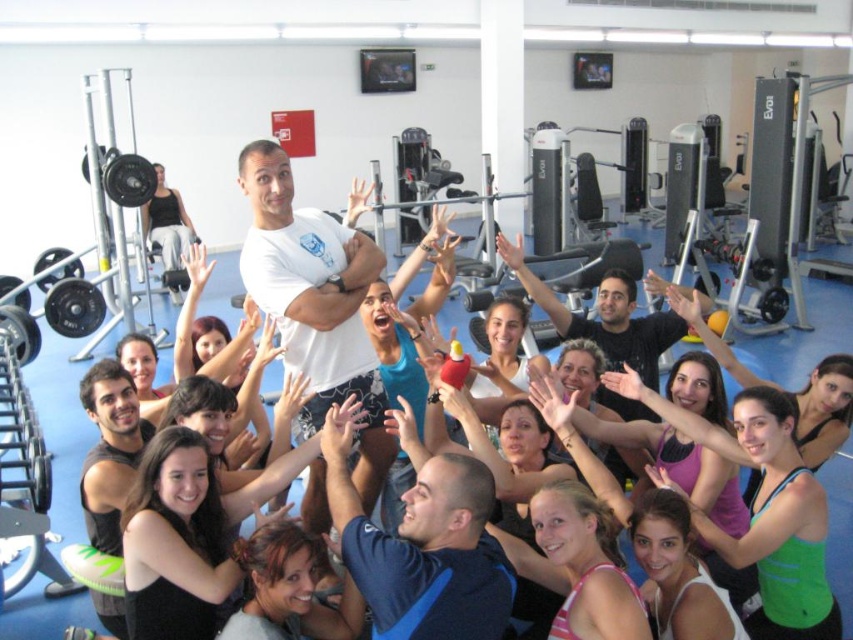
Question: Among these objects, which one is farthest from the camera?

Choices:
 (A) matte black arm at center
 (B) purple fabric arm at center

Answer: (A)

Question: Does blue fabric shirt at center appear on the right side of matte black arm at center?

Choices:
 (A) no
 (B) yes

Answer: (A)

Question: Is white matte t-shirt at center wider than matte black arm at center?

Choices:
 (A) yes
 (B) no

Answer: (A)

Question: Which point is closer to the camera taking this photo?

Choices:
 (A) (704, 428)
 (B) (558, 310)
 (C) (482, 522)
 (D) (270, 145)

Answer: (C)

Question: Which object is closer to the camera taking this photo?

Choices:
 (A) blue fabric shirt at center
 (B) white matte t-shirt at center
 (C) purple fabric arm at center

Answer: (A)

Question: Can you confirm if white matte t-shirt at center is positioned above blue fabric shirt at center?

Choices:
 (A) no
 (B) yes

Answer: (B)